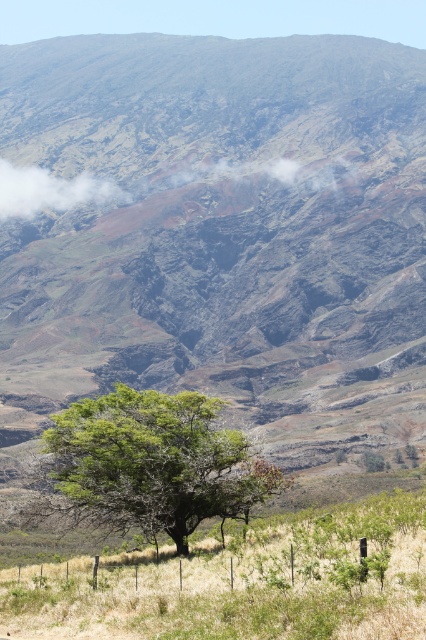
You are standing at the point marked as point (247, 584) in the image. What do you see directly beneath your feet?

You see dry grass at center directly beneath your feet at point (247, 584).

You are a hiker who wants to take a photo of the white fluffy cloud at upper center. You are standing on the dry grass at center. Which direction should you look to capture the cloud in your photo?

The dry grass at center is positioned under the white fluffy cloud at upper center, so you should look upward to capture the white fluffy cloud at upper center in your photo.